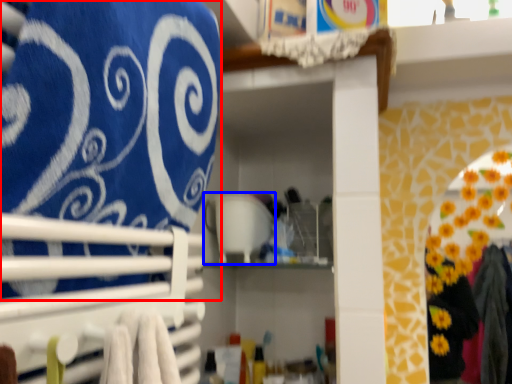
Question: Which object is closer to the camera taking this photo, bath towel (highlighted by a red box) or appliance (highlighted by a blue box)?

Choices:
 (A) bath towel
 (B) appliance

Answer: (A)